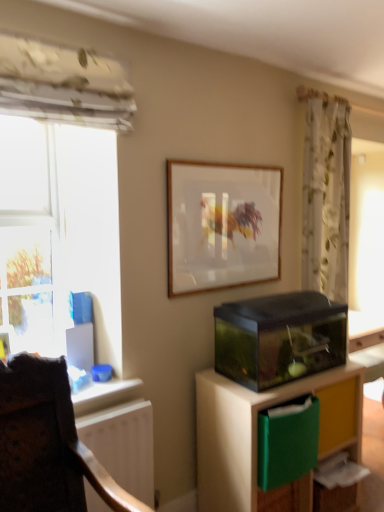
Question: Does floral fabric curtain at upper right have a smaller size compared to wooden frame at upper center?

Choices:
 (A) no
 (B) yes

Answer: (A)

Question: Considering the relative sizes of floral fabric curtain at upper right and wooden frame at upper center in the image provided, is floral fabric curtain at upper right taller than wooden frame at upper center?

Choices:
 (A) no
 (B) yes

Answer: (B)

Question: Is wooden frame at upper center located within floral fabric curtain at upper right?

Choices:
 (A) no
 (B) yes

Answer: (A)

Question: Is floral fabric curtain at upper right far away from wooden frame at upper center?

Choices:
 (A) yes
 (B) no

Answer: (B)

Question: Is floral fabric curtain at upper right outside wooden frame at upper center?

Choices:
 (A) yes
 (B) no

Answer: (A)

Question: From a real-world perspective, is floral fabric curtain at upper right located higher than wooden frame at upper center?

Choices:
 (A) no
 (B) yes

Answer: (A)

Question: From a real-world perspective, is floral fabric curtain at upper right over transparent glass aquarium at lower right?

Choices:
 (A) no
 (B) yes

Answer: (B)

Question: Does floral fabric curtain at upper right come behind transparent glass aquarium at lower right?

Choices:
 (A) no
 (B) yes

Answer: (B)

Question: Is floral fabric curtain at upper right positioned far away from transparent glass aquarium at lower right?

Choices:
 (A) yes
 (B) no

Answer: (B)

Question: Is floral fabric curtain at upper right positioned before transparent glass aquarium at lower right?

Choices:
 (A) no
 (B) yes

Answer: (A)

Question: Does floral fabric curtain at upper right turn towards transparent glass aquarium at lower right?

Choices:
 (A) yes
 (B) no

Answer: (B)

Question: Is transparent glass aquarium at lower right a part of floral fabric curtain at upper right?

Choices:
 (A) yes
 (B) no

Answer: (B)

Question: Can you confirm if transparent glass aquarium at lower right is smaller than white matte radiator at lower left?

Choices:
 (A) no
 (B) yes

Answer: (A)